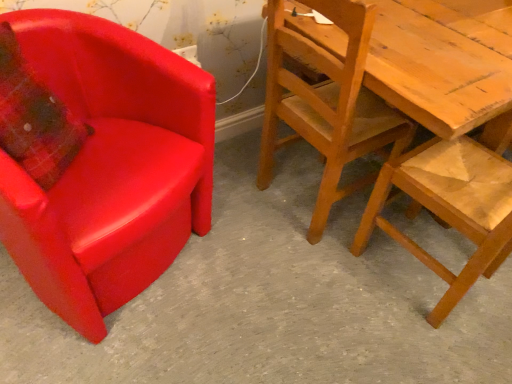
Question: Is there a large distance between matte red armchair at left, the third chair when ordered from right to left, and wooden textured chair at right, which ranks as the third chair in left-to-right order?

Choices:
 (A) yes
 (B) no

Answer: (B)

Question: Considering the relative positions of matte red armchair at left, the third chair when ordered from right to left, and wooden textured chair at right, which ranks as the third chair in left-to-right order, in the image provided, is matte red armchair at left, the third chair when ordered from right to left, to the left of wooden textured chair at right, which ranks as the third chair in left-to-right order, from the viewer's perspective?

Choices:
 (A) no
 (B) yes

Answer: (B)

Question: Is the position of matte red armchair at left, the third chair when ordered from right to left, more distant than that of wooden textured chair at right, which is the 1th chair from right to left?

Choices:
 (A) yes
 (B) no

Answer: (B)

Question: Can you confirm if matte red armchair at left, marked as the first chair in a left-to-right arrangement, is bigger than wooden textured chair at right, which ranks as the third chair in left-to-right order?

Choices:
 (A) yes
 (B) no

Answer: (A)

Question: From the image's perspective, would you say matte red armchair at left, marked as the first chair in a left-to-right arrangement, is shown under wooden textured chair at right, which is the 1th chair from right to left?

Choices:
 (A) yes
 (B) no

Answer: (B)

Question: Is point (500, 117) positioned closer to the camera than point (166, 264)?

Choices:
 (A) farther
 (B) closer

Answer: (A)

Question: Visually, is wooden textured chair at right, which is the 1th chair from right to left, positioned to the left or to the right of matte red armchair at left, the third chair when ordered from right to left?

Choices:
 (A) right
 (B) left

Answer: (A)

Question: From their relative heights in the image, would you say wooden textured chair at right, which ranks as the third chair in left-to-right order, is taller or shorter than matte red armchair at left, the third chair when ordered from right to left?

Choices:
 (A) short
 (B) tall

Answer: (B)

Question: In terms of width, does wooden textured chair at right, which ranks as the third chair in left-to-right order, look wider or thinner when compared to matte red armchair at left, marked as the first chair in a left-to-right arrangement?

Choices:
 (A) thin
 (B) wide

Answer: (A)

Question: Is wooden chair at right, the second chair positioned from the left, inside the boundaries of wooden textured chair at right, which is the 1th chair from right to left, or outside?

Choices:
 (A) outside
 (B) inside

Answer: (A)

Question: From a real-world perspective, is wooden chair at right, the second chair positioned from the left, physically located above or below wooden textured chair at right, which is the 1th chair from right to left?

Choices:
 (A) above
 (B) below

Answer: (A)

Question: Looking at the image, does wooden chair at right, the second chair positioned from the left, seem bigger or smaller compared to wooden textured chair at right, which is the 1th chair from right to left?

Choices:
 (A) small
 (B) big

Answer: (B)

Question: In terms of width, does wooden chair at right, positioned as the 2th chair in right-to-left order, look wider or thinner when compared to wooden textured chair at right, which is the 1th chair from right to left?

Choices:
 (A) wide
 (B) thin

Answer: (A)

Question: From a real-world perspective, is matte red armchair at left, marked as the first chair in a left-to-right arrangement, above or below wooden chair at right, positioned as the 2th chair in right-to-left order?

Choices:
 (A) above
 (B) below

Answer: (B)

Question: Is matte red armchair at left, marked as the first chair in a left-to-right arrangement, situated inside wooden chair at right, positioned as the 2th chair in right-to-left order, or outside?

Choices:
 (A) inside
 (B) outside

Answer: (B)